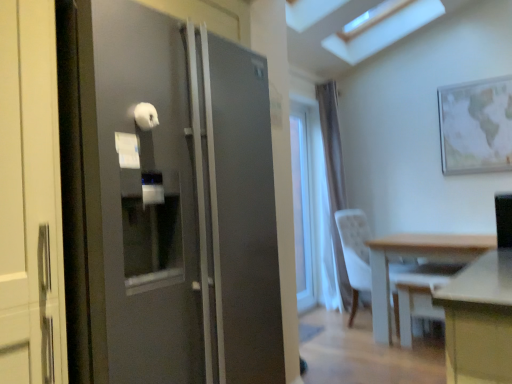
Question: In terms of size, does light wood table at lower right appear bigger or smaller than clear glass window at center?

Choices:
 (A) small
 (B) big

Answer: (B)

Question: In the image, is light wood table at lower right positioned in front of or behind clear glass window at center?

Choices:
 (A) behind
 (B) front

Answer: (B)

Question: Considering the real-world distances, which object is farthest from the white plastic swivel chair at lower right?

Choices:
 (A) satin black refrigerator at left
 (B) white sheer curtain at center
 (C) white fabric chair at right
 (D) matte wooden map at upper right
 (E) light wood table at lower right

Answer: (A)

Question: Which is nearer to the white plastic swivel chair at lower right?

Choices:
 (A) light wood table at lower right
 (B) clear glass window at center
 (C) white fabric chair at right
 (D) satin black refrigerator at left
 (E) white sheer curtain at center

Answer: (A)